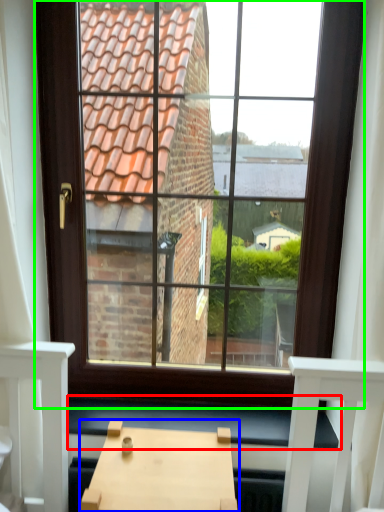
Question: Which object is positioned closest to window sill (highlighted by a red box)? Select from table (highlighted by a blue box) and window (highlighted by a green box).

Choices:
 (A) table
 (B) window

Answer: (B)